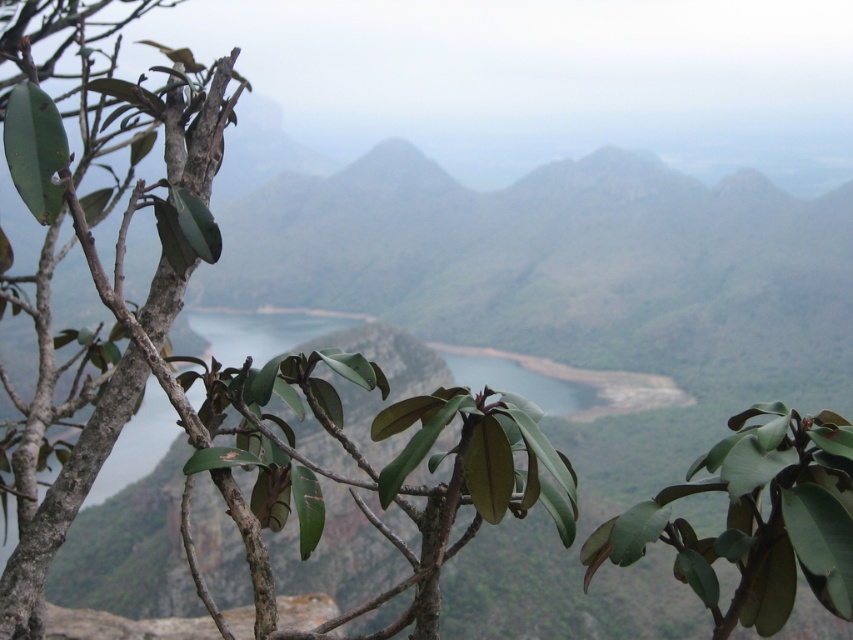
Between green matte leaves at center and green matte leaf at center, which one has more height?

With more height is green matte leaves at center.

Is point (10, 108) closer to camera compared to point (759, 547)?

No.

The width and height of the screenshot is (853, 640). What do you see at coordinates (213, 358) in the screenshot?
I see `green matte leaves at center` at bounding box center [213, 358].

The image size is (853, 640). I want to click on green matte leaves at center, so click(x=213, y=358).